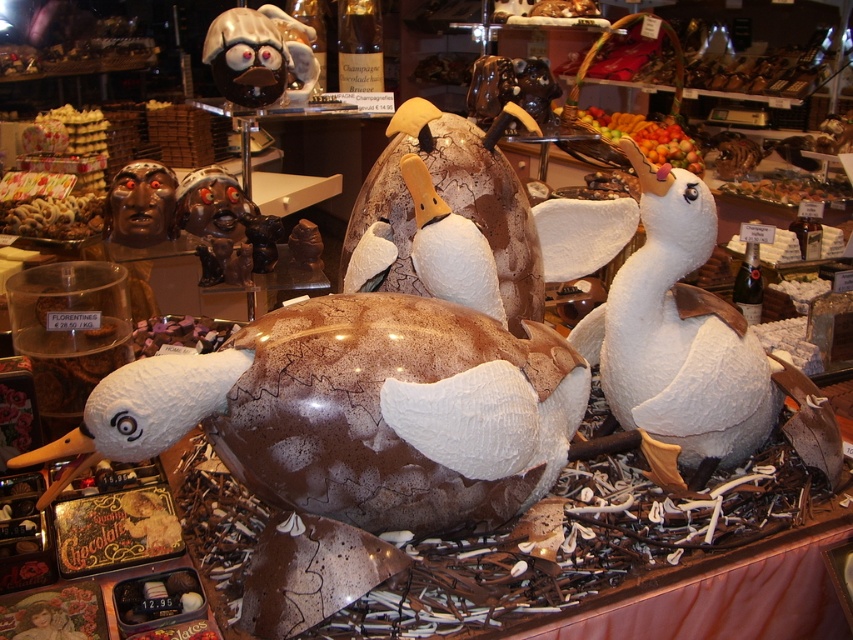
You are a customer in the confectionery shop and want to know which object is taller between the white matte duckling at center and the shiny chocolate figurine at upper center. Can you help me determine which one is taller?

The white matte duckling at center has a greater height compared to the shiny chocolate figurine at upper center, so the white matte duckling at center is taller.

You are a customer in the confectionery shop and want to take a photo of the turtle sculpture and the ducks. Which point, point (641, 372) or point (274, 17), should you focus on to ensure the turtle sculpture with the ducks is in sharp focus?

You should focus on point (641, 372) because it is closer to the viewer than point (274, 17), ensuring the turtle sculpture with the ducks is in sharp focus.

You are a customer in the confectionery shop and want to buy the white matte duckling at center and the shiny chocolate figurine at upper center. If you look from the entrance, which one is positioned more to the right side?

The white matte duckling at center is positioned to the right of the shiny chocolate figurine at upper center, so the white matte duckling at center is more to the right side.